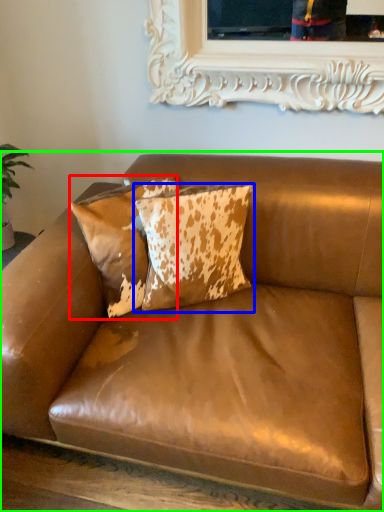
Question: Which is nearer to the pillow (highlighted by a red box)? pillow (highlighted by a blue box) or studio couch (highlighted by a green box).

Choices:
 (A) pillow
 (B) studio couch

Answer: (A)